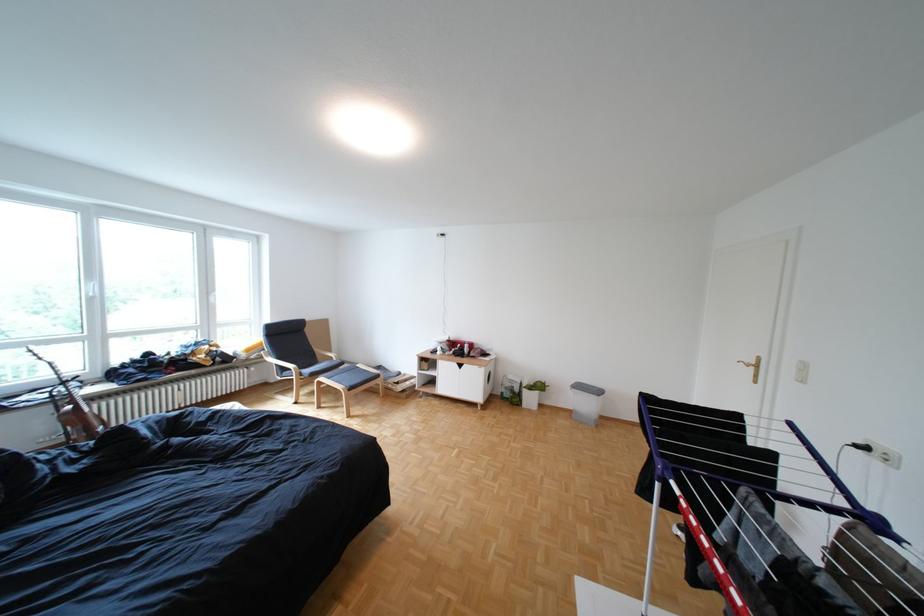
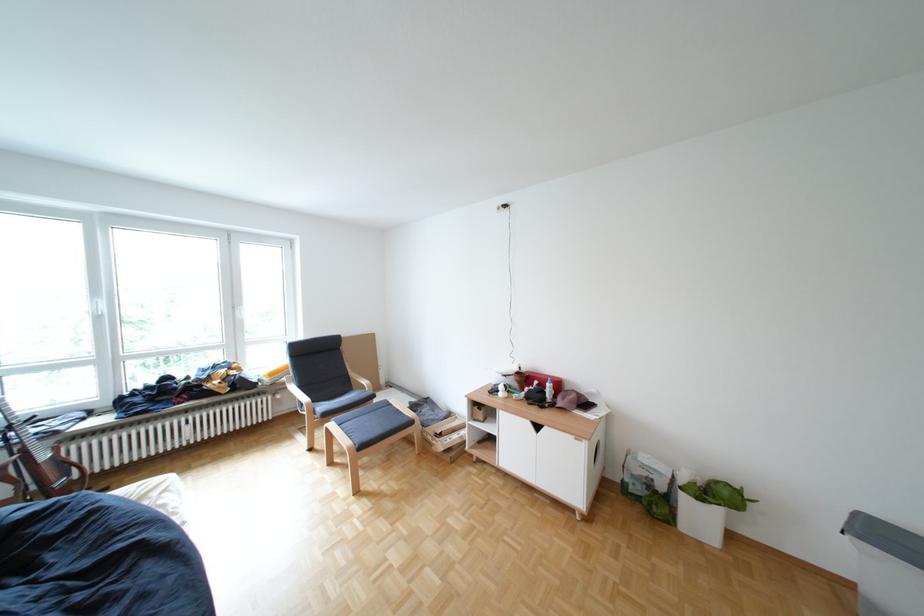
Find the pixel in the second image that matches (x=263, y=351) in the first image.

(286, 374)